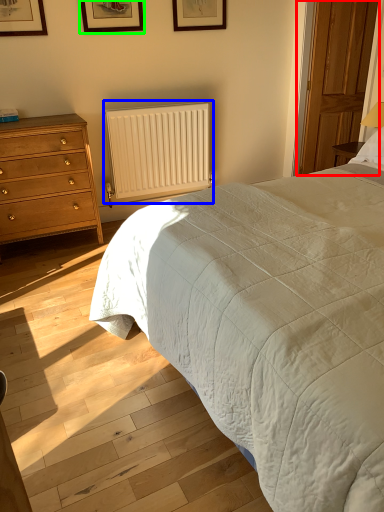
Question: Which is nearer to the glass door (highlighted by a red box)? radiator (highlighted by a blue box) or picture frame (highlighted by a green box).

Choices:
 (A) radiator
 (B) picture frame

Answer: (A)